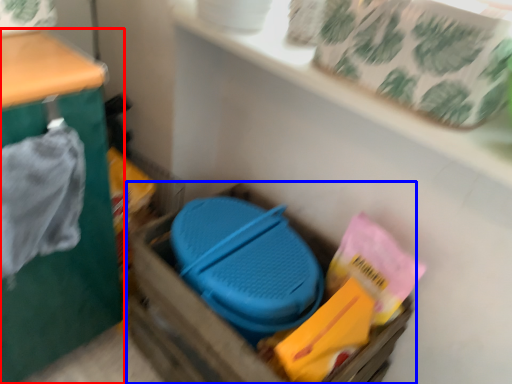
Question: Which object is closer to the camera taking this photo, furniture (highlighted by a red box) or storage box (highlighted by a blue box)?

Choices:
 (A) furniture
 (B) storage box

Answer: (A)